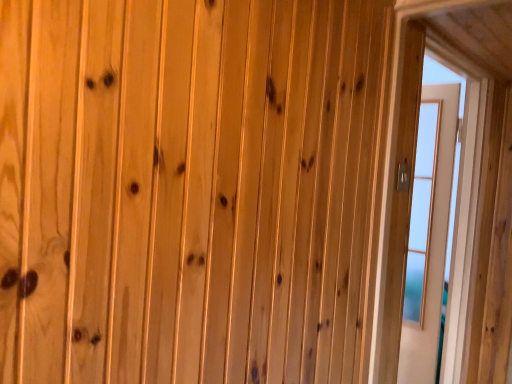
Question: Is transparent glass door at right completely or partially inside light brown wood door at right?

Choices:
 (A) yes
 (B) no

Answer: (B)

Question: Is light brown wood door at right taller than transparent glass door at right?

Choices:
 (A) no
 (B) yes

Answer: (B)

Question: Is light brown wood door at right at the right side of transparent glass door at right?

Choices:
 (A) yes
 (B) no

Answer: (A)

Question: Can you confirm if light brown wood door at right is wider than transparent glass door at right?

Choices:
 (A) yes
 (B) no

Answer: (B)

Question: Can you confirm if light brown wood door at right is positioned to the left of transparent glass door at right?

Choices:
 (A) no
 (B) yes

Answer: (A)

Question: From a real-world perspective, is light brown wood door at right on top of transparent glass door at right?

Choices:
 (A) yes
 (B) no

Answer: (B)

Question: Is transparent glass door at right oriented towards light brown wood door at right?

Choices:
 (A) yes
 (B) no

Answer: (B)

Question: From the image's perspective, is transparent glass door at right located beneath light brown wood door at right?

Choices:
 (A) no
 (B) yes

Answer: (A)

Question: Would you say light brown wood door at right is part of transparent glass door at right's contents?

Choices:
 (A) no
 (B) yes

Answer: (A)

Question: Is transparent glass door at right thinner than light brown wood door at right?

Choices:
 (A) no
 (B) yes

Answer: (A)

Question: Can you confirm if transparent glass door at right is taller than light brown wood door at right?

Choices:
 (A) no
 (B) yes

Answer: (A)

Question: Are transparent glass door at right and light brown wood door at right far apart?

Choices:
 (A) yes
 (B) no

Answer: (B)

Question: Is point (402, 77) closer or farther from the camera than point (449, 102)?

Choices:
 (A) farther
 (B) closer

Answer: (B)